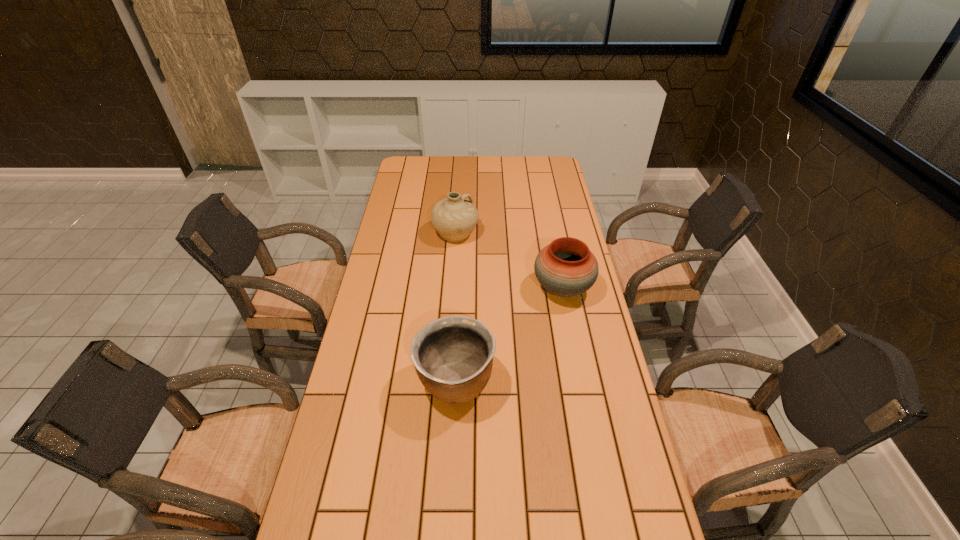
Locate an element on the screen. This screenshot has width=960, height=540. vacant position in the image that satisfies the following two spatial constraints: 1. on the back side of the second nearest pottery; 2. on the left side of the nearest pottery is located at coordinates (460, 288).